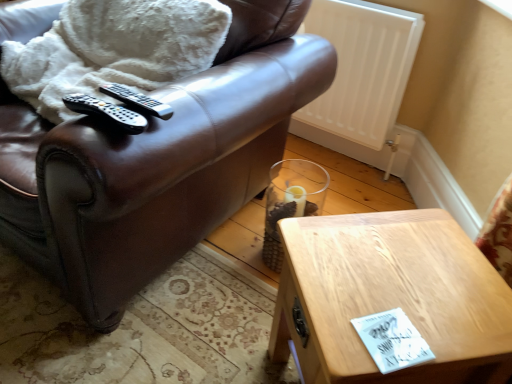
Question: Considering the positions of white fluffy blanket at upper left and white matte radiator at upper right in the image, is white fluffy blanket at upper left wider or thinner than white matte radiator at upper right?

Choices:
 (A) wide
 (B) thin

Answer: (A)

Question: In terms of height, does white fluffy blanket at upper left look taller or shorter compared to white matte radiator at upper right?

Choices:
 (A) tall
 (B) short

Answer: (B)

Question: Which object is the farthest from the black plastic remote at upper left, the second remote positioned from the front?

Choices:
 (A) wooden table at lower right
 (B) brown leather chair at upper left
 (C) white matte radiator at upper right
 (D) clear glass vase at lower center
 (E) white fluffy blanket at upper left

Answer: (C)

Question: Which of these objects is positioned farthest from the white matte radiator at upper right?

Choices:
 (A) clear glass vase at lower center
 (B) wooden table at lower right
 (C) black plastic remote at upper left, which ranks as the first remote in back-to-front order
 (D) brown leather chair at upper left
 (E) black plastic remote at center, the first remote in the front-to-back sequence

Answer: (E)